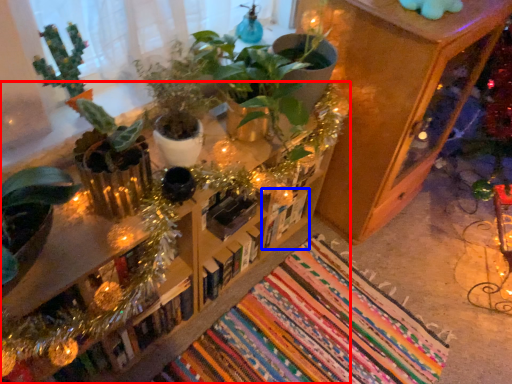
Question: Which object appears farthest to the camera in this image, furniture (highlighted by a red box) or book (highlighted by a blue box)?

Choices:
 (A) furniture
 (B) book

Answer: (B)